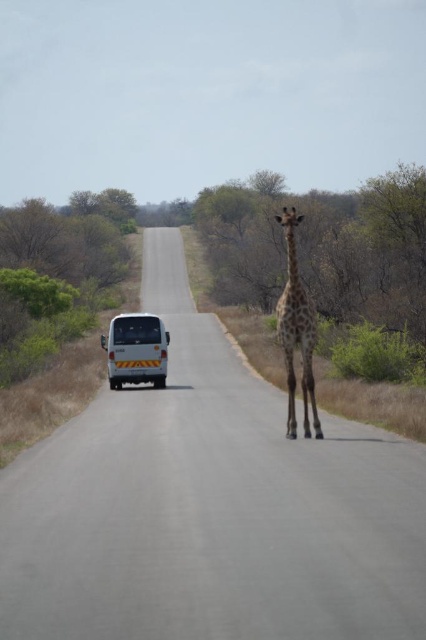
You are a wildlife photographer standing at the edge of the road. You notice a spotted fur giraffe at center and a white matte van at center. Which object is wider from your perspective?

The spotted fur giraffe at center is wider than the white matte van at center according to the description.

Consider the image. You are a tour guide driving a white matte van at center on a savanna road. You notice a spotted fur giraffe at center blocking your path. Can you safely drive around it without hitting the giraffe?

The spotted fur giraffe at center is much taller than the white matte van at center. Since the giraffe is taller, it might have its head above the van, but the van can still safely drive around the giraffe as long as there is enough space on the road. However, the height difference does not directly affect the ability to maneuver around it horizontally.